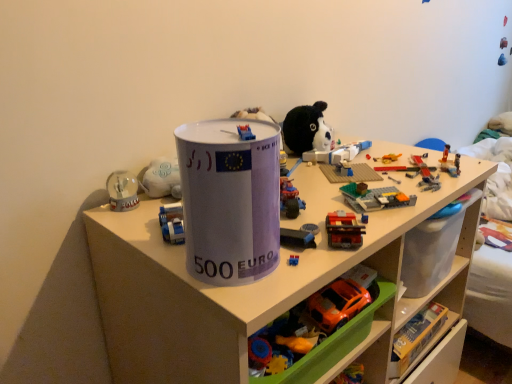
Question: Does rubberized plastic toy car at center, which is the 1th toy from top to bottom, turn towards brick-like plastic train at center-right, the second toy positioned from the top?

Choices:
 (A) no
 (B) yes

Answer: (A)

Question: Is rubberized plastic toy car at center, which is the 1th toy from top to bottom, surrounding brick-like plastic train at center-right, the third toy when ordered from bottom to top?

Choices:
 (A) yes
 (B) no

Answer: (B)

Question: Does rubberized plastic toy car at center, which is the 1th toy from top to bottom, have a lesser height compared to brick-like plastic train at center-right, the third toy when ordered from bottom to top?

Choices:
 (A) no
 (B) yes

Answer: (A)

Question: Is brick-like plastic train at center-right, the third toy when ordered from bottom to top, at the back of rubberized plastic toy car at center, which is the 1th toy from top to bottom?

Choices:
 (A) no
 (B) yes

Answer: (A)

Question: Does rubberized plastic toy car at center, which appears as the 4th toy when ordered from the bottom, have a larger size compared to brick-like plastic train at center-right, the third toy when ordered from bottom to top?

Choices:
 (A) no
 (B) yes

Answer: (B)

Question: Considering the relative positions of rubberized plastic toy car at center, which appears as the 4th toy when ordered from the bottom, and brick-like plastic train at center-right, the third toy when ordered from bottom to top, in the image provided, is rubberized plastic toy car at center, which appears as the 4th toy when ordered from the bottom, behind brick-like plastic train at center-right, the third toy when ordered from bottom to top,?

Choices:
 (A) no
 (B) yes

Answer: (B)

Question: Does white plastic shelf at center have a lesser height compared to orange plastic car at lower center, the fourth toy positioned from the top?

Choices:
 (A) yes
 (B) no

Answer: (B)

Question: Is white plastic shelf at center positioned in front of orange plastic car at lower center, the fourth toy positioned from the top?

Choices:
 (A) no
 (B) yes

Answer: (B)

Question: Is white plastic shelf at center next to orange plastic car at lower center, the first toy in the bottom-to-top sequence?

Choices:
 (A) no
 (B) yes

Answer: (A)

Question: Is white plastic shelf at center outside of orange plastic car at lower center, the fourth toy positioned from the top?

Choices:
 (A) yes
 (B) no

Answer: (A)

Question: Does white plastic shelf at center turn towards orange plastic car at lower center, the first toy in the bottom-to-top sequence?

Choices:
 (A) yes
 (B) no

Answer: (A)

Question: Can you confirm if white plastic shelf at center is smaller than orange plastic car at lower center, the fourth toy positioned from the top?

Choices:
 (A) yes
 (B) no

Answer: (B)

Question: Does brick-like plastic train at center-right, the third toy when ordered from bottom to top, appear on the left side of white plastic shelf at center?

Choices:
 (A) yes
 (B) no

Answer: (B)